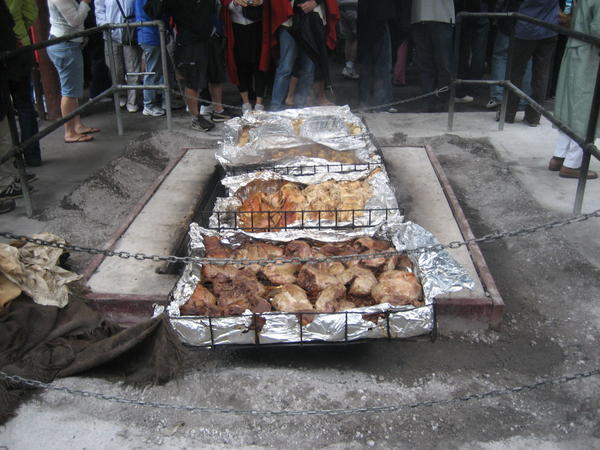
Identify the location of wire trays. This screenshot has height=450, width=600. (388, 330), (337, 221), (315, 168), (365, 136).